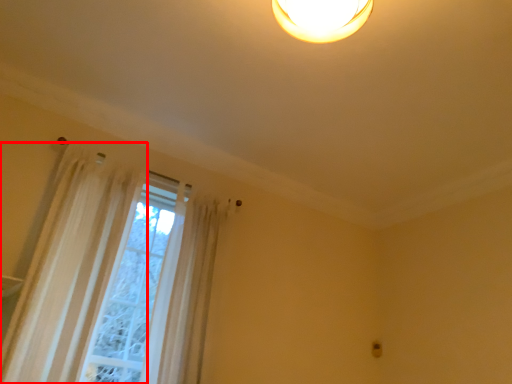
Question: From the image's perspective, where is curtain (annotated by the red box) located in relation to shower curtain in the image?

Choices:
 (A) below
 (B) above

Answer: (B)